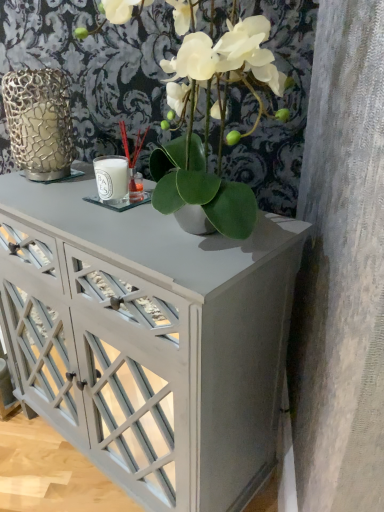
This screenshot has height=512, width=384. In order to click on vacant space underneath gold textured vase at left (from a real-world perspective) in this screenshot , I will do `click(48, 180)`.